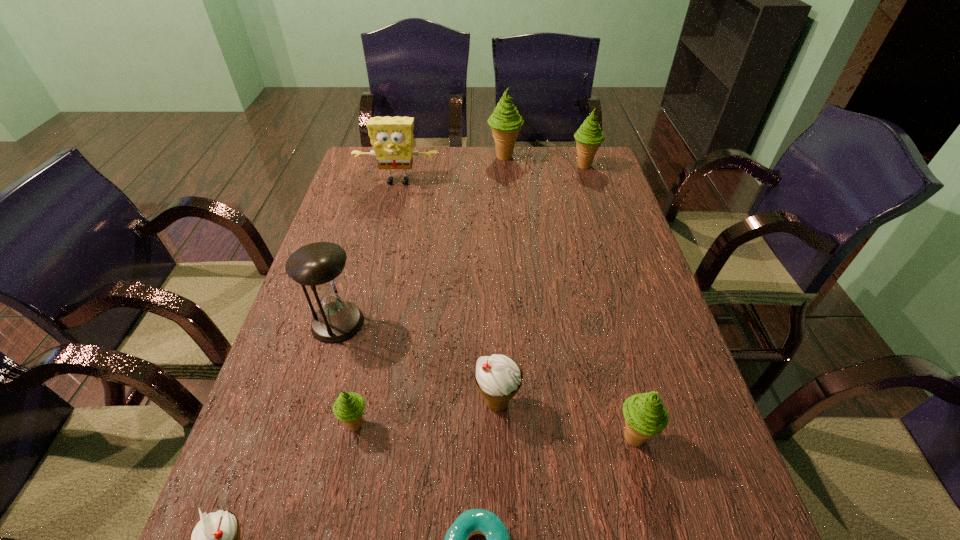
Identify the location of free space located 0.110m on the left of the biggest green icecream. (457, 157).

Where is `vacant position located 0.340m on the face of the sponge`? vacant position located 0.340m on the face of the sponge is located at coordinates (380, 259).

This screenshot has width=960, height=540. In order to click on blank space located on the front of the third smallest green icecream in this screenshot , I will do `click(602, 224)`.

Locate an element on the screen. This screenshot has height=540, width=960. vacant space situated 0.150m on the back of the fourth farthest object is located at coordinates (355, 262).

The image size is (960, 540). Find the location of `vacant area situated 0.190m on the back of the bigger white icecream`. vacant area situated 0.190m on the back of the bigger white icecream is located at coordinates (494, 315).

I want to click on vacant space located 0.280m on the left of the third biggest green icecream, so click(469, 437).

The height and width of the screenshot is (540, 960). In order to click on vacant space situated 0.260m on the back of the leftmost green icecream in this screenshot , I will do `click(380, 313)`.

Identify the location of sponge present at the far edge. The width and height of the screenshot is (960, 540). (391, 137).

What are the coordinates of `sponge at the left edge` in the screenshot? It's located at (391, 137).

The image size is (960, 540). I want to click on hourglass positioned at the left edge, so click(x=318, y=265).